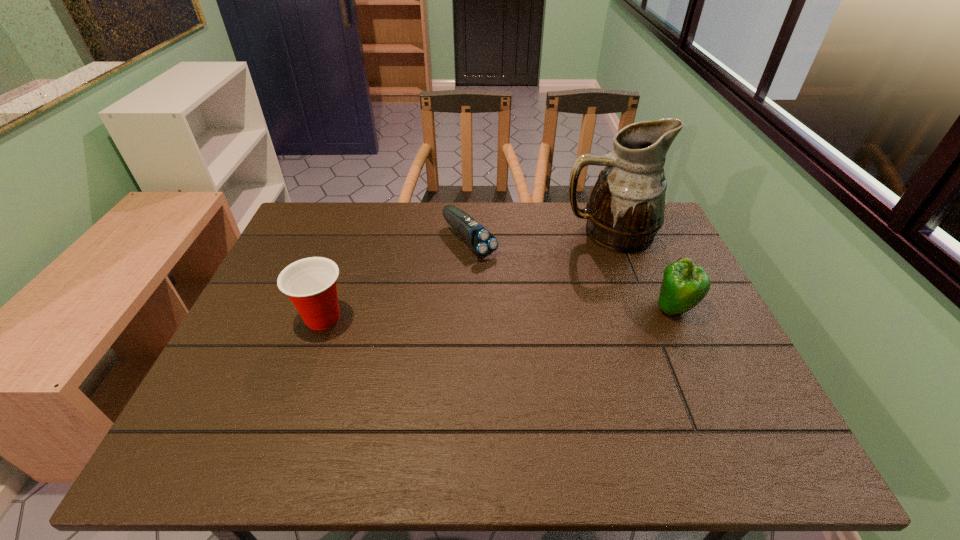
Where is `vacant region that satisfies the following two spatial constraints: 1. on the back side of the shortest object; 2. on the right side of the pitcher`? The height and width of the screenshot is (540, 960). vacant region that satisfies the following two spatial constraints: 1. on the back side of the shortest object; 2. on the right side of the pitcher is located at coordinates (469, 233).